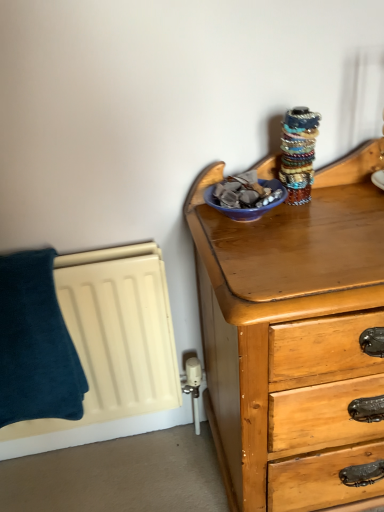
Question: From a real-world perspective, is dark blue plush towel at left physically located above or below blue glossy bowl at upper right?

Choices:
 (A) above
 (B) below

Answer: (B)

Question: From the image's perspective, is dark blue plush towel at left above or below blue glossy bowl at upper right?

Choices:
 (A) below
 (B) above

Answer: (A)

Question: Is dark blue plush towel at left taller or shorter than blue glossy bowl at upper right?

Choices:
 (A) tall
 (B) short

Answer: (A)

Question: In the image, is blue glossy bowl at upper right on the left side or the right side of dark blue plush towel at left?

Choices:
 (A) right
 (B) left

Answer: (A)

Question: From a real-world perspective, relative to dark blue plush towel at left, is blue glossy bowl at upper right vertically above or below?

Choices:
 (A) below
 (B) above

Answer: (B)

Question: Considering their positions, is blue glossy bowl at upper right located in front of or behind dark blue plush towel at left?

Choices:
 (A) behind
 (B) front

Answer: (B)

Question: Is blue glossy bowl at upper right taller or shorter than dark blue plush towel at left?

Choices:
 (A) short
 (B) tall

Answer: (A)